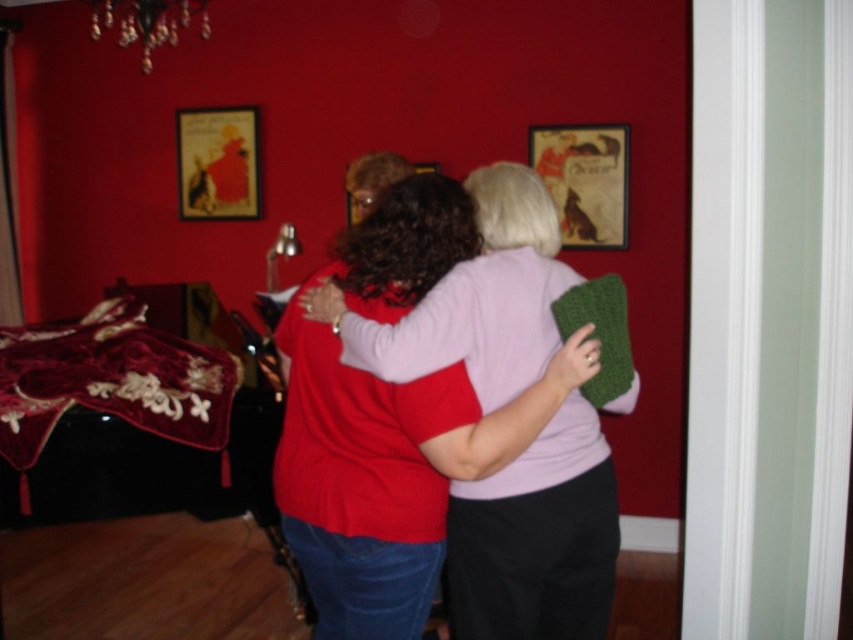
Question: Which of the following is the farthest from the observer?

Choices:
 (A) (619, 138)
 (B) (202, 220)
 (C) (425, 168)

Answer: (B)

Question: Which point is closer to the camera?

Choices:
 (A) (624, 177)
 (B) (508, 218)
 (C) (257, 177)

Answer: (B)

Question: Considering the real-world distances, which object is closest to the metallic gold picture frame at center?

Choices:
 (A) metallic gold picture frame at upper center
 (B) matte pink sweater at center
 (C) matte black picture frame at upper center

Answer: (A)

Question: Is matte pink sweater at center smaller than metallic gold picture frame at center?

Choices:
 (A) no
 (B) yes

Answer: (A)

Question: Can you confirm if matte pink sweater at center is positioned above matte black picture frame at upper center?

Choices:
 (A) yes
 (B) no

Answer: (B)

Question: Is matte pink sweater at center to the right of metallic gold picture frame at upper center from the viewer's perspective?

Choices:
 (A) yes
 (B) no

Answer: (B)